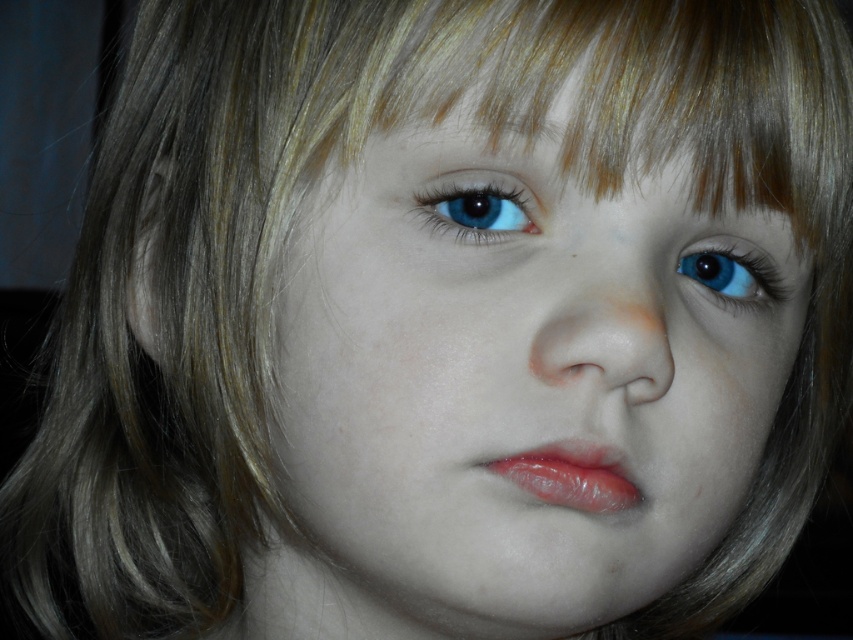
Looking at the child in the portrait, which object has a greater width between the smooth skin nose at center and the blue glossy eye at upper center?

The smooth skin nose at center has a greater width than the blue glossy eye at upper center.

You are taking a photo of a child and want to focus on two specific points. The first point is point (576, 364) and the second is point (495, 225). Which point should you focus on first to ensure the child is in focus?

Point (576, 364) is in front of point (495, 225), so you should focus on point (576, 364) first to ensure the child is in focus.

Looking at the child in the portrait, where is the smooth skin nose at center positioned relative to the blue glossy eye at center?

The smooth skin nose at center is to the left of the blue glossy eye at center.